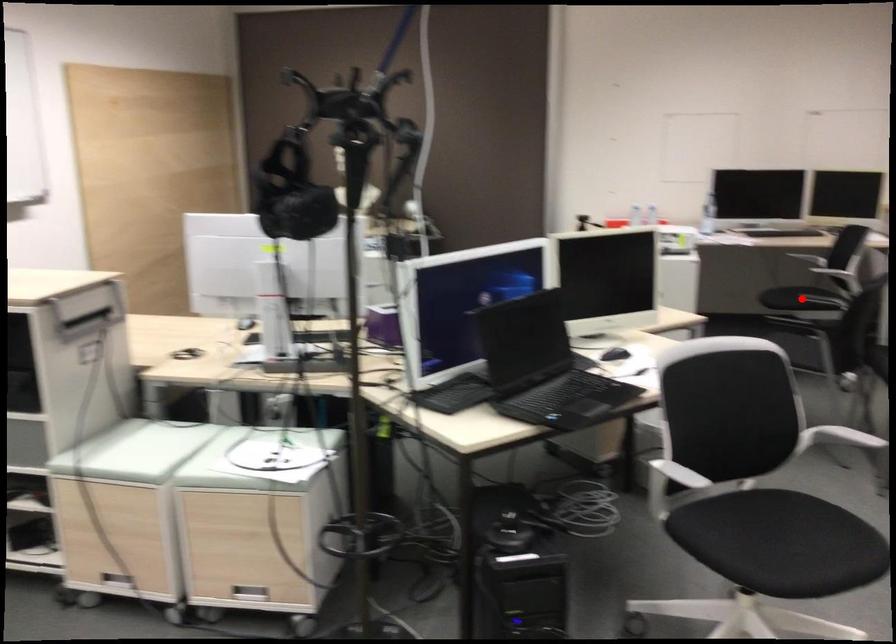
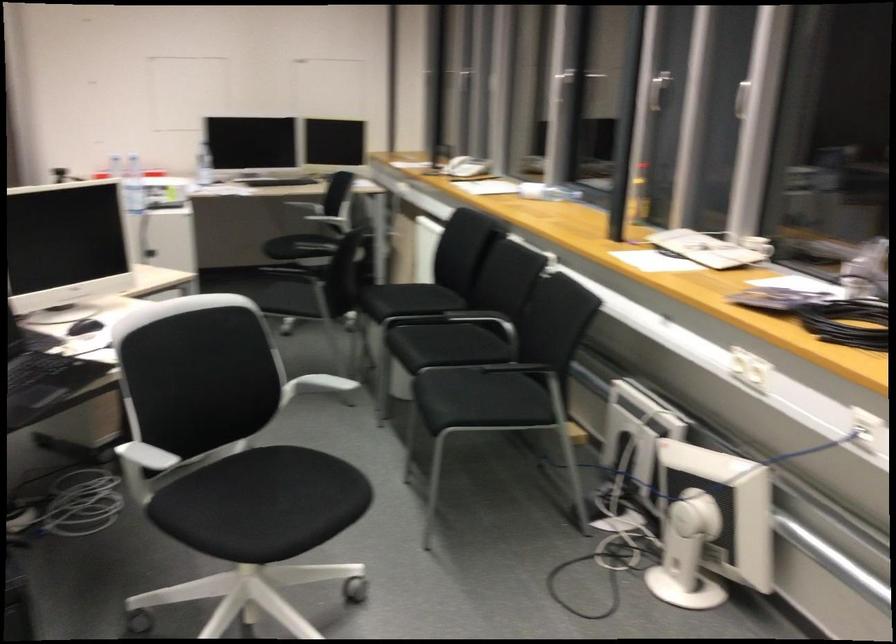
Question: I am providing you with two images of the same scene from different viewpoints. Given a red point in image1, look at the same physical point in image2. Is it:

Choices:
 (A) Closer to the viewpoint
 (B) Farther from the viewpoint

Answer: (B)